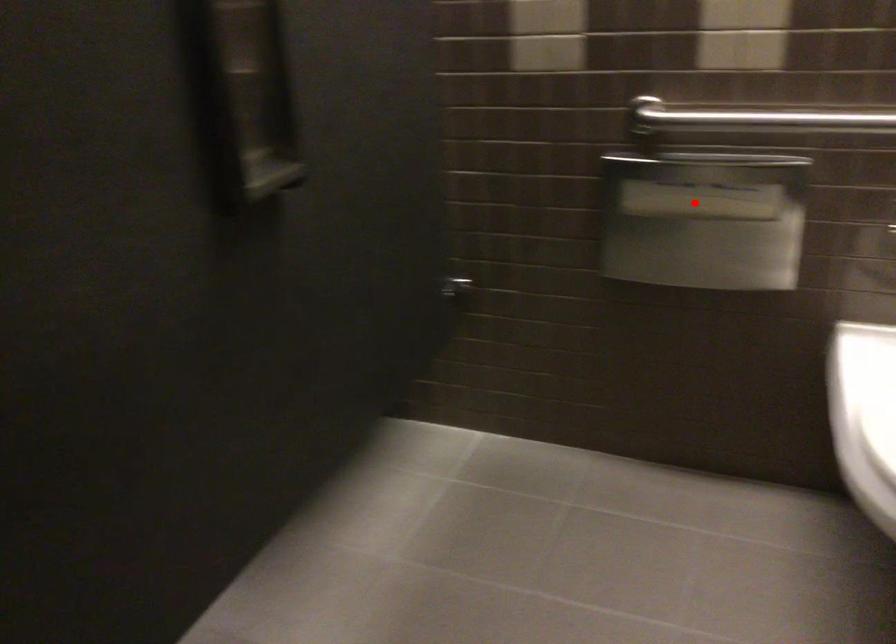
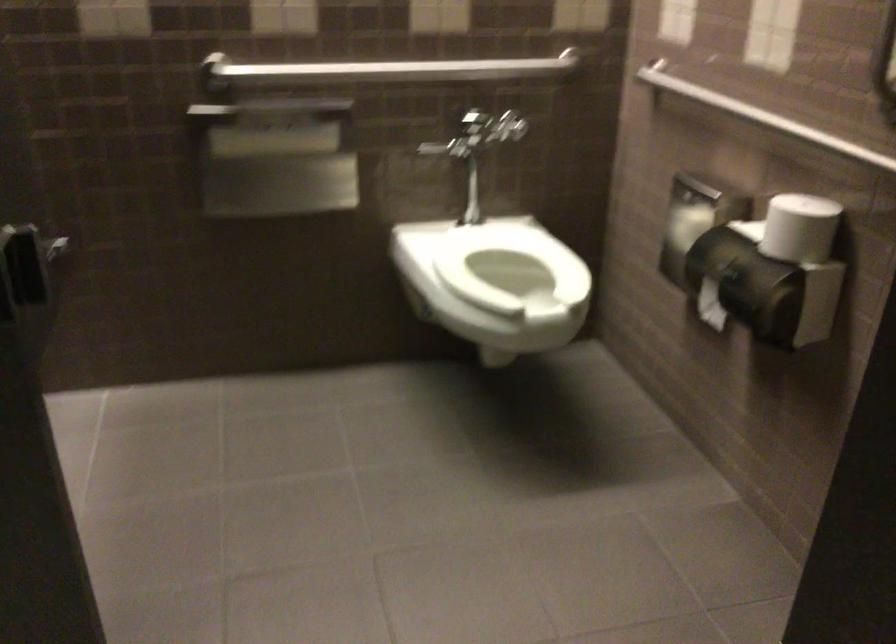
The point at the highlighted location is marked in the first image. Where is the corresponding point in the second image?

(273, 143)